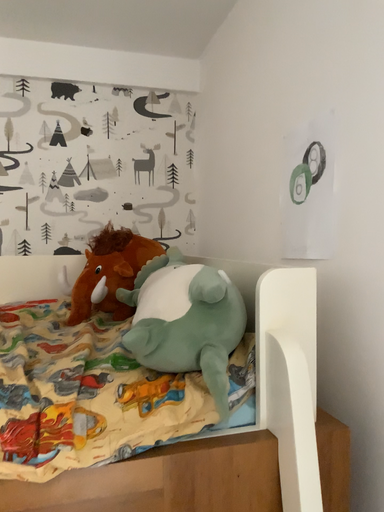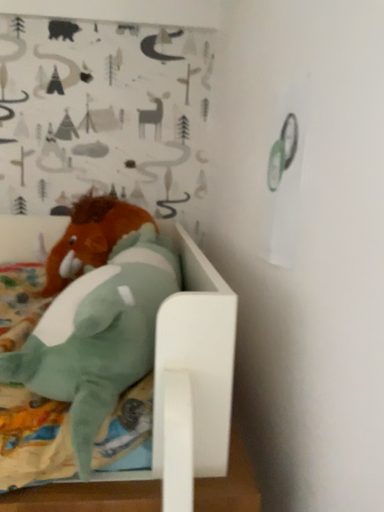
Question: Which way did the camera rotate in the video?

Choices:
 (A) rotated downward
 (B) rotated upward

Answer: (A)